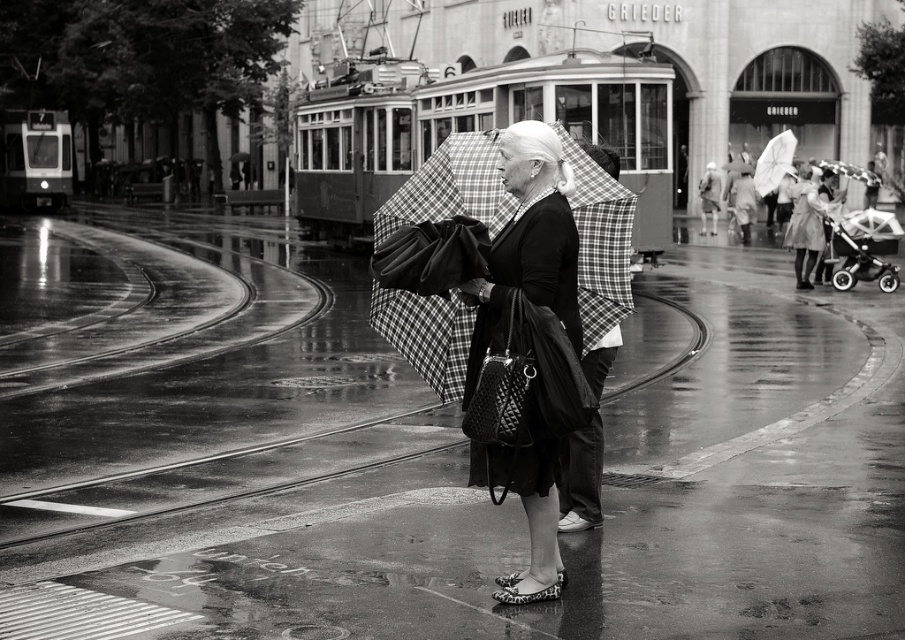
Is matte black dress at center to the right of metallic stroller at right from the viewer's perspective?

No, matte black dress at center is not to the right of metallic stroller at right.

Between matte black dress at center and metallic stroller at right, which one is positioned higher?

metallic stroller at right is above.

What do you see at coordinates (527, 353) in the screenshot?
I see `matte black dress at center` at bounding box center [527, 353].

This screenshot has width=905, height=640. What are the coordinates of `matte black dress at center` in the screenshot? It's located at (527, 353).

Is the position of wet asphalt at center less distant than that of white matte umbrella at upper right?

That is True.

Who is shorter, wet asphalt at center or white matte umbrella at upper right?

wet asphalt at center is shorter.

Is point (87, 472) in front of point (770, 141)?

Yes, point (87, 472) is closer to viewer.

I want to click on wet asphalt at center, so click(420, 452).

Who is more distant from viewer, (648, 276) or (453, 342)?

Positioned behind is point (648, 276).

Which is more to the right, wet asphalt at center or plaid fabric umbrella at center?

From the viewer's perspective, wet asphalt at center appears more on the right side.

Between point (820, 396) and point (403, 204), which one is positioned in front?

Point (403, 204) is more forward.

You are a GUI agent. You are given a task and a screenshot of the screen. Output one action in this format:
    pyautogui.click(x=<x>, y=<y>)
    Task: Click on the wet asphalt at center
    This screenshot has width=905, height=640.
    Given the screenshot: What is the action you would take?
    pyautogui.click(x=420, y=452)